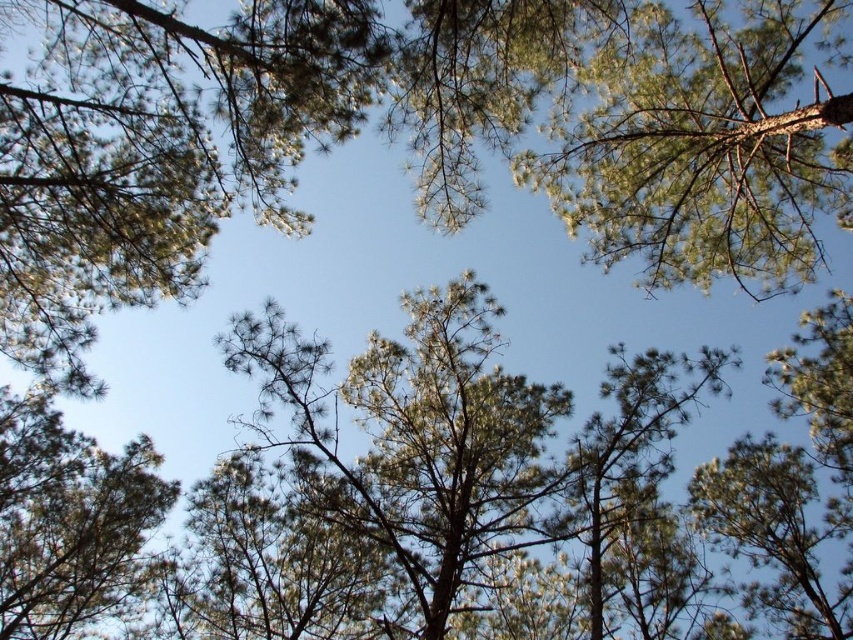
Question: Is green needle-like at upper right to the right of green needle-like at upper left from the viewer's perspective?

Choices:
 (A) yes
 (B) no

Answer: (A)

Question: Which point is closer to the camera?

Choices:
 (A) green needle-like at upper left
 (B) green needle-like at upper right

Answer: (B)

Question: Is green needle-like at upper right in front of green needle-like at upper left?

Choices:
 (A) no
 (B) yes

Answer: (B)

Question: Can you confirm if green needle-like at upper right is positioned above green needle-like at upper left?

Choices:
 (A) no
 (B) yes

Answer: (B)

Question: Which point is farther to the camera?

Choices:
 (A) green needle-like at upper right
 (B) green needle-like at upper left

Answer: (B)